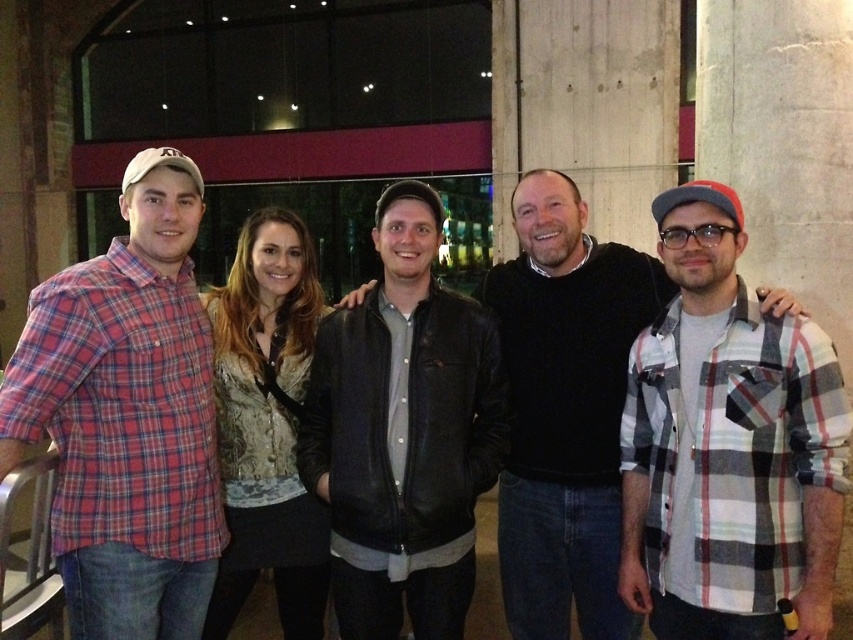
You are standing in front of the group photo and want to point out two specific points. The first point is at coordinates point (3, 420) and the second is at point (572, 456). Which of these two points is closer to you?

Point (3, 420) is closer to the viewer than point (572, 456).